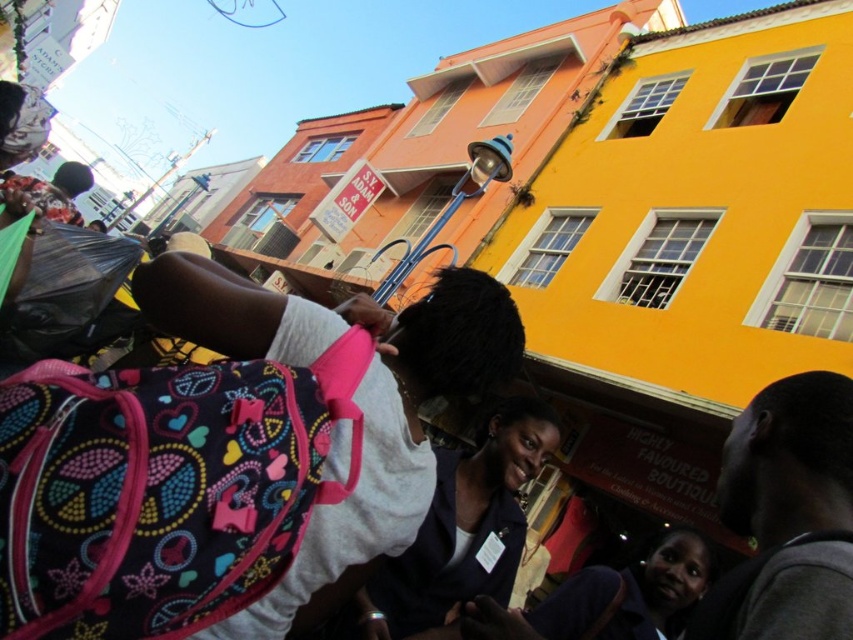
You are standing at the center of the street scene and want to locate the dark gray sweater at lower right. According to the coordinates provided, where exactly is it positioned in terms of horizontal and vertical placement?

The dark gray sweater at lower right is positioned at the 2D coordinate point of 0.805 on the horizontal axis and 0.924 on the vertical axis.

You are a photographer standing in the street scene. You want to take a photo that includes both the dark gray sweater at lower right and the dark blue fabric jacket at center. Based on their positions, which one will appear higher in the photo?

The dark gray sweater at lower right appears higher in the photo than the dark blue fabric jacket at center because it is positioned above it.